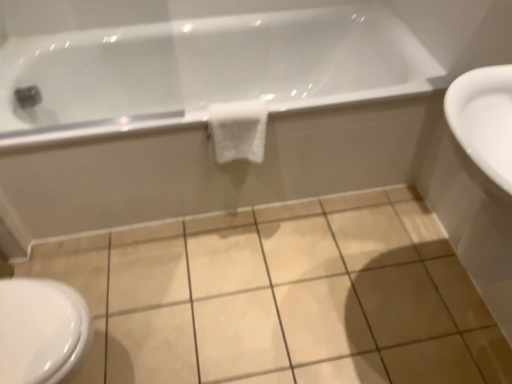
Question: From a real-world perspective, is white glossy bathtub at upper center positioned above or below white glossy bidet at lower left?

Choices:
 (A) above
 (B) below

Answer: (B)

Question: Considering the positions of white glossy bathtub at upper center and white glossy bidet at lower left in the image, is white glossy bathtub at upper center taller or shorter than white glossy bidet at lower left?

Choices:
 (A) short
 (B) tall

Answer: (B)

Question: Estimate the real-world distances between objects in this image. Which object is closer to the white glossy bathtub at upper center?

Choices:
 (A) white soft towel at center
 (B) white glossy sink at right
 (C) beige ceramic tile at center
 (D) white glossy bidet at lower left

Answer: (A)

Question: Based on their relative distances, which object is farther from the white soft towel at center?

Choices:
 (A) white glossy bidet at lower left
 (B) white glossy bathtub at upper center
 (C) beige ceramic tile at center
 (D) white glossy sink at right

Answer: (A)